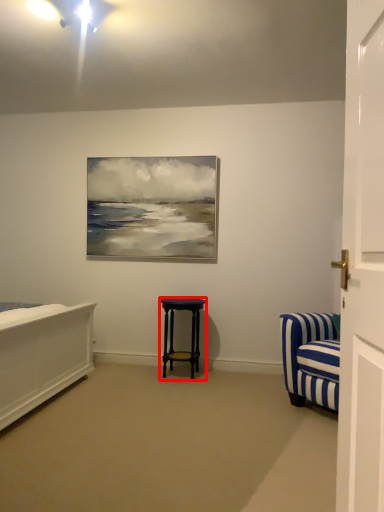
Question: From the image's perspective, considering the relative positions of stool (annotated by the red box) and door in the image provided, where is stool (annotated by the red box) located with respect to the staircase?

Choices:
 (A) below
 (B) above

Answer: (A)